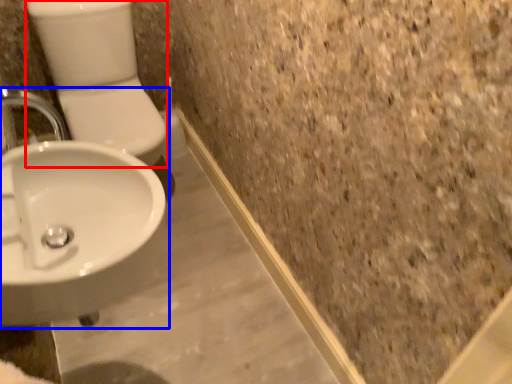
Question: Which object appears closest to the camera in this image, toilet bowl (highlighted by a red box) or sink (highlighted by a blue box)?

Choices:
 (A) toilet bowl
 (B) sink

Answer: (B)